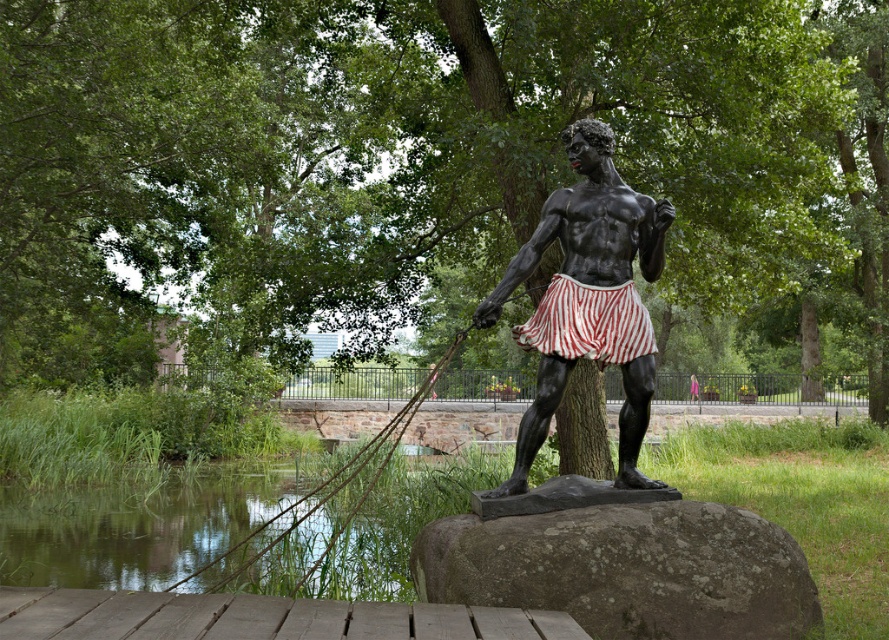
Question: Is rough gray rock at center further to camera compared to roperough at right?

Choices:
 (A) yes
 (B) no

Answer: (B)

Question: Is black glossy statue at center below roperough at right?

Choices:
 (A) yes
 (B) no

Answer: (B)

Question: Among these points, which one is nearest to the camera?

Choices:
 (A) [x=355, y=497]
 (B) [x=543, y=588]
 (C) [x=533, y=237]

Answer: (B)

Question: Can you confirm if clear water at lower left is positioned below black glossy statue at center?

Choices:
 (A) no
 (B) yes

Answer: (B)

Question: Among these points, which one is nearest to the camera?

Choices:
 (A) (637, 204)
 (B) (20, 580)

Answer: (A)

Question: Estimate the real-world distances between objects in this image. Which object is closer to the roperough at right?

Choices:
 (A) rough gray rock at center
 (B) black glossy statue at center
 (C) clear water at lower left

Answer: (C)